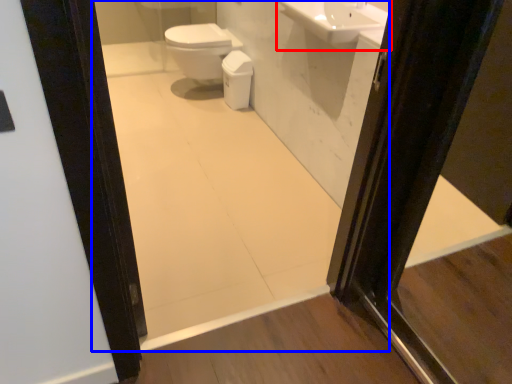
Question: Which of the following is the closest to the observer, sink (highlighted by a red box) or mirror (highlighted by a blue box)?

Choices:
 (A) sink
 (B) mirror

Answer: (B)